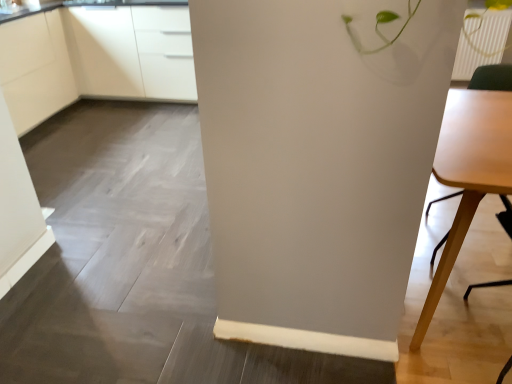
Question: Is white glossy cabinets at upper left, which is the first cabinetry in right-to-left order, looking in the opposite direction of light wood table at right?

Choices:
 (A) no
 (B) yes

Answer: (A)

Question: Is white glossy cabinets at upper left, which is the first cabinetry in right-to-left order, facing towards light wood table at right?

Choices:
 (A) yes
 (B) no

Answer: (B)

Question: Is white glossy cabinets at upper left, which is the 2th cabinetry in left-to-right order, shorter than light wood table at right?

Choices:
 (A) yes
 (B) no

Answer: (B)

Question: Is white glossy cabinets at upper left, which is the first cabinetry in right-to-left order, next to light wood table at right?

Choices:
 (A) no
 (B) yes

Answer: (A)

Question: Is white glossy cabinets at upper left, which is the first cabinetry in right-to-left order, not within light wood table at right?

Choices:
 (A) yes
 (B) no

Answer: (A)

Question: From a real-world perspective, relative to white glossy cabinets at upper left, which is the 2th cabinetry in left-to-right order, is white matte cabinet at upper left, marked as the second cabinetry in a right-to-left arrangement, vertically above or below?

Choices:
 (A) below
 (B) above

Answer: (A)

Question: In the image, is white matte cabinet at upper left, marked as the 1th cabinetry in a left-to-right arrangement, positioned in front of or behind white glossy cabinets at upper left, which is the first cabinetry in right-to-left order?

Choices:
 (A) behind
 (B) front

Answer: (B)

Question: Is white matte cabinet at upper left, marked as the 1th cabinetry in a left-to-right arrangement, to the left or to the right of white glossy cabinets at upper left, which is the 2th cabinetry in left-to-right order, in the image?

Choices:
 (A) right
 (B) left

Answer: (B)

Question: Based on their sizes in the image, would you say white matte cabinet at upper left, marked as the second cabinetry in a right-to-left arrangement, is bigger or smaller than white glossy cabinets at upper left, which is the first cabinetry in right-to-left order?

Choices:
 (A) big
 (B) small

Answer: (B)

Question: Relative to light wood table at right, is white matte cabinet at upper left, marked as the second cabinetry in a right-to-left arrangement, in front or behind?

Choices:
 (A) front
 (B) behind

Answer: (B)

Question: Based on their sizes in the image, would you say white matte cabinet at upper left, marked as the 1th cabinetry in a left-to-right arrangement, is bigger or smaller than light wood table at right?

Choices:
 (A) small
 (B) big

Answer: (B)

Question: From the image's perspective, is white matte cabinet at upper left, marked as the 1th cabinetry in a left-to-right arrangement, located above or below light wood table at right?

Choices:
 (A) above
 (B) below

Answer: (A)

Question: Choose the correct answer: Is white matte cabinet at upper left, marked as the 1th cabinetry in a left-to-right arrangement, inside light wood table at right or outside it?

Choices:
 (A) inside
 (B) outside

Answer: (B)

Question: Considering the positions of light wood table at right and white glossy cabinets at upper left, which is the first cabinetry in right-to-left order, in the image, is light wood table at right taller or shorter than white glossy cabinets at upper left, which is the first cabinetry in right-to-left order,?

Choices:
 (A) tall
 (B) short

Answer: (B)

Question: Would you say light wood table at right is to the left or to the right of white glossy cabinets at upper left, which is the first cabinetry in right-to-left order, in the picture?

Choices:
 (A) left
 (B) right

Answer: (B)